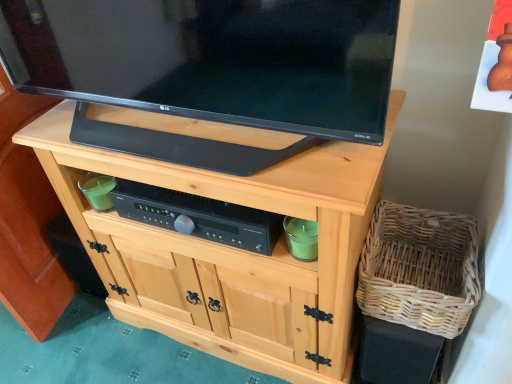
Question: From a real-world perspective, is black plastic control at center positioned under black glossy tv at upper center based on gravity?

Choices:
 (A) yes
 (B) no

Answer: (A)

Question: Is black plastic control at center bigger than black glossy tv at upper center?

Choices:
 (A) yes
 (B) no

Answer: (B)

Question: From the image's perspective, is black plastic control at center over black glossy tv at upper center?

Choices:
 (A) no
 (B) yes

Answer: (A)

Question: Can you confirm if black plastic control at center is positioned to the left of black glossy tv at upper center?

Choices:
 (A) no
 (B) yes

Answer: (A)

Question: Can you confirm if black plastic control at center is thinner than black glossy tv at upper center?

Choices:
 (A) no
 (B) yes

Answer: (B)

Question: Does black plastic control at center contain black glossy tv at upper center?

Choices:
 (A) yes
 (B) no

Answer: (B)

Question: Is natural wood cabinet at center completely or partially outside of black plastic control at center?

Choices:
 (A) yes
 (B) no

Answer: (A)

Question: From a real-world perspective, is natural wood cabinet at center positioned over black plastic control at center based on gravity?

Choices:
 (A) yes
 (B) no

Answer: (B)

Question: Could you tell me if natural wood cabinet at center is facing black plastic control at center?

Choices:
 (A) no
 (B) yes

Answer: (B)

Question: Does natural wood cabinet at center have a lesser width compared to black plastic control at center?

Choices:
 (A) no
 (B) yes

Answer: (A)

Question: Does natural wood cabinet at center have a smaller size compared to black plastic control at center?

Choices:
 (A) no
 (B) yes

Answer: (A)

Question: Does natural wood cabinet at center have a lesser height compared to black plastic control at center?

Choices:
 (A) no
 (B) yes

Answer: (A)

Question: Can you confirm if woven natural basket at lower right is taller than black plastic control at center?

Choices:
 (A) no
 (B) yes

Answer: (B)